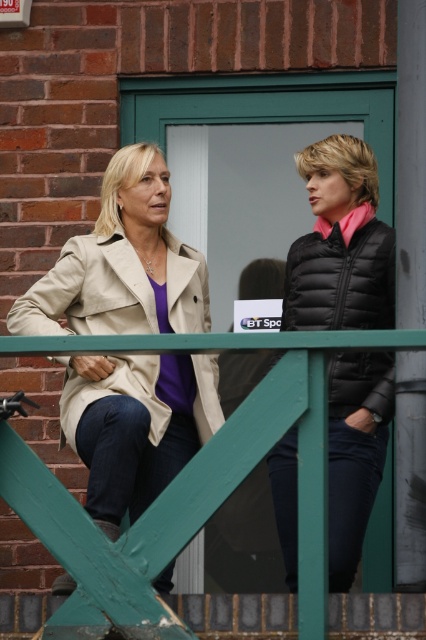
Question: Does black puffer jacket at upper right have a larger size compared to beige fabric coat at left?

Choices:
 (A) yes
 (B) no

Answer: (A)

Question: Which of the following is the closest to the observer?

Choices:
 (A) beige fabric coat at left
 (B) black quilted vest at right
 (C) black puffer jacket at upper right
 (D) green wooden rail at upper center

Answer: (D)

Question: Based on their relative distances, which object is nearer to the black quilted vest at right?

Choices:
 (A) beige fabric coat at left
 (B) black puffer jacket at upper right
 (C) green wooden rail at upper center

Answer: (B)

Question: Is green wooden rail at upper center below black quilted vest at right?

Choices:
 (A) yes
 (B) no

Answer: (A)

Question: Which object is farther from the camera taking this photo?

Choices:
 (A) green wooden rail at upper center
 (B) beige fabric coat at left
 (C) black quilted vest at right

Answer: (B)

Question: Does green wooden rail at upper center appear on the left side of black quilted vest at right?

Choices:
 (A) yes
 (B) no

Answer: (A)